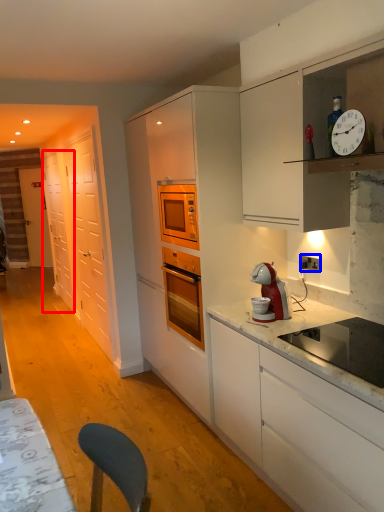
Question: Which object is further to the camera taking this photo, glass door (highlighted by a red box) or electric outlet (highlighted by a blue box)?

Choices:
 (A) glass door
 (B) electric outlet

Answer: (A)